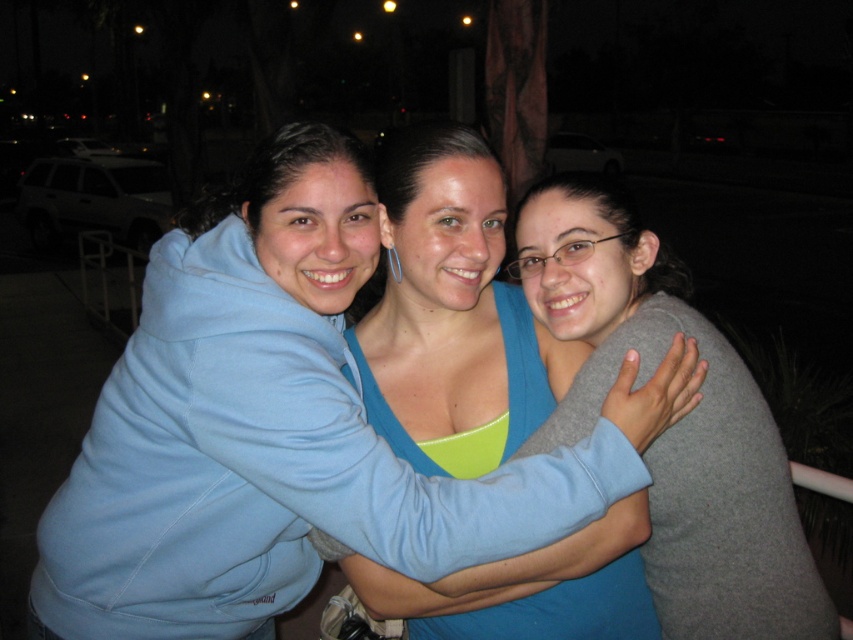
Question: Which point is farther to the camera?

Choices:
 (A) (735, 380)
 (B) (520, 595)

Answer: (A)

Question: Does blue fabric top at center have a larger size compared to gray matte sweater at center?

Choices:
 (A) yes
 (B) no

Answer: (A)

Question: Is blue fabric top at center closer to camera compared to gray matte sweater at center?

Choices:
 (A) no
 (B) yes

Answer: (B)

Question: Which point is closer to the camera?

Choices:
 (A) blue fabric top at center
 (B) gray matte sweater at center

Answer: (A)

Question: Can you confirm if blue fabric top at center is thinner than gray matte sweater at center?

Choices:
 (A) yes
 (B) no

Answer: (B)